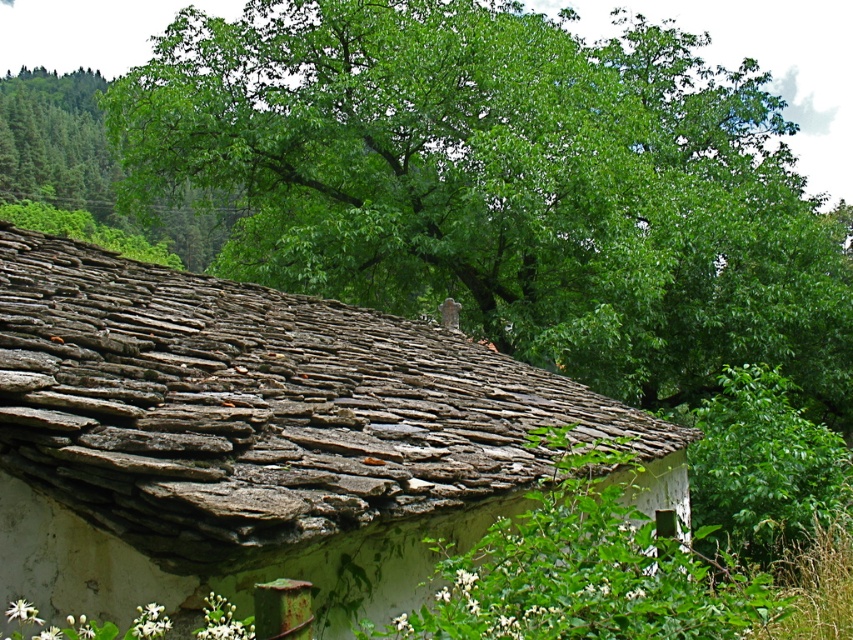
Question: Does green leafy tree at upper center come behind rusty slate roof at center?

Choices:
 (A) yes
 (B) no

Answer: (A)

Question: Is green leafy tree at upper center further to the viewer compared to rusty slate roof at center?

Choices:
 (A) yes
 (B) no

Answer: (A)

Question: Which point is closer to the camera?

Choices:
 (A) green leafy tree at upper center
 (B) rusty slate roof at center

Answer: (B)

Question: From the image, what is the correct spatial relationship of green leafy tree at upper center in relation to rusty slate roof at center?

Choices:
 (A) left
 (B) right

Answer: (B)